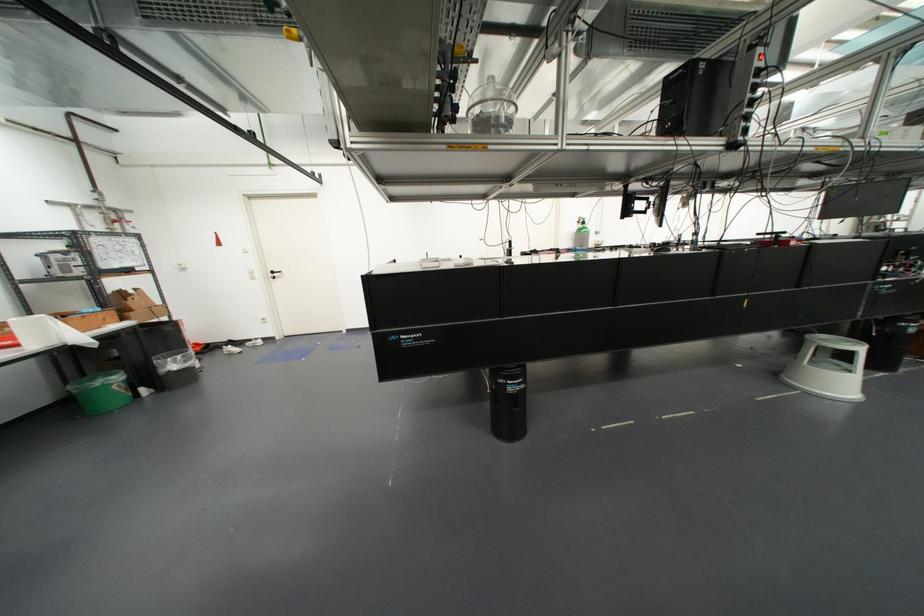
Where would you turn the door handle? Please return your answer as a coordinate pair (x, y).

(274, 274)